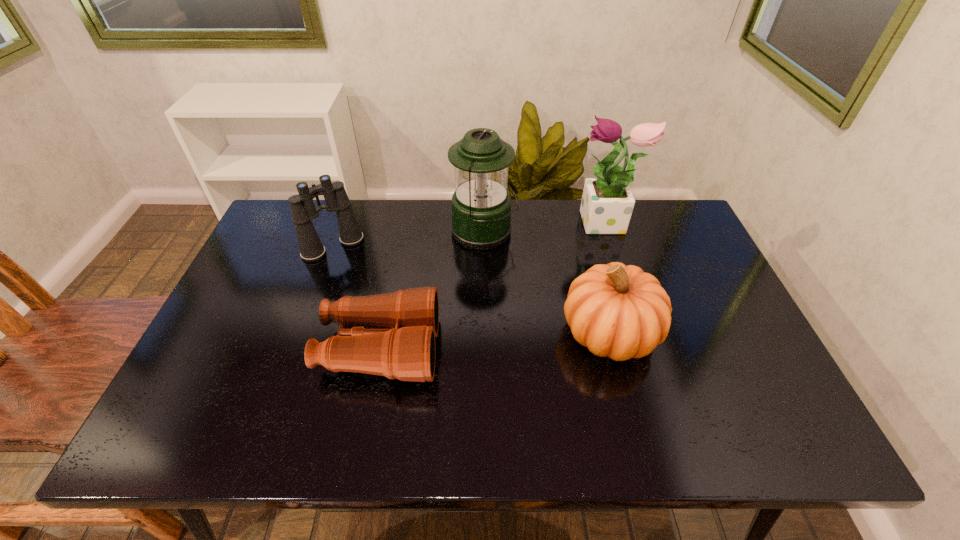
I want to click on vacant area that lies between the pumpkin and the taller binoculars, so click(471, 289).

Identify which object is located as the fourth nearest to the pumpkin. Please provide its 2D coordinates. Your answer should be formatted as a tuple, i.e. [(x, y)], where the tuple contains the x and y coordinates of a point satisfying the conditions above.

[(303, 210)]

This screenshot has width=960, height=540. I want to click on object that is the second closest to the pumpkin, so click(x=607, y=203).

The width and height of the screenshot is (960, 540). Find the location of `vacant space that satisfies the following two spatial constraints: 1. on the front-facing side of the flower arrangement; 2. on the front side of the pumpkin`. vacant space that satisfies the following two spatial constraints: 1. on the front-facing side of the flower arrangement; 2. on the front side of the pumpkin is located at coordinates (639, 332).